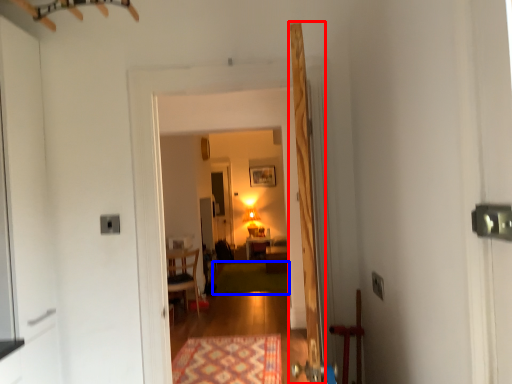
Question: Which object is further to the camera taking this photo, door (highlighted by a red box) or mat (highlighted by a blue box)?

Choices:
 (A) door
 (B) mat

Answer: (B)